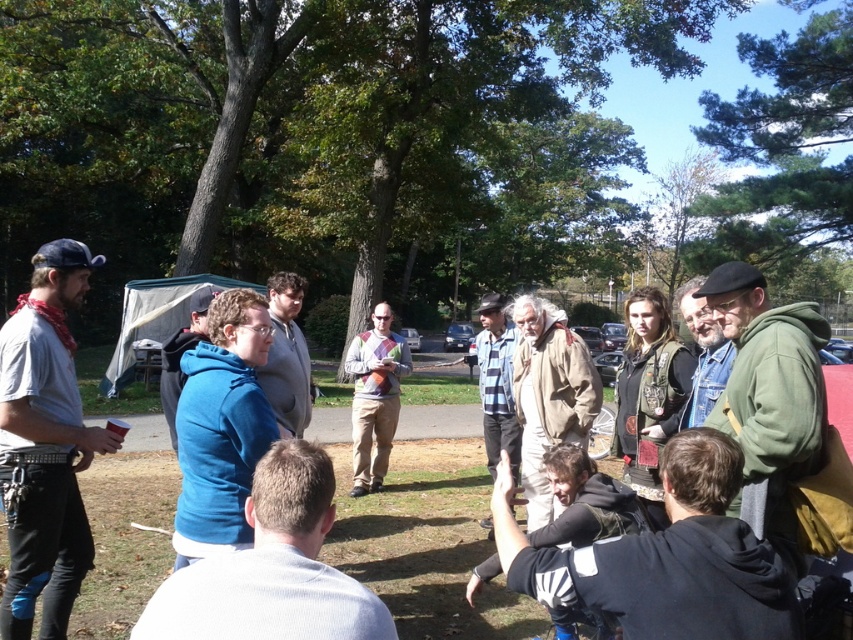
Question: Which of the following is the farthest from the observer?

Choices:
 (A) (276, 358)
 (B) (549, 387)
 (C) (181, 355)

Answer: (B)

Question: Is white ribbed sweater at center to the right of striped cotton shirt at center from the viewer's perspective?

Choices:
 (A) no
 (B) yes

Answer: (A)

Question: Which point is closer to the camera taking this photo?

Choices:
 (A) (496, 298)
 (B) (599, 397)
 (C) (306, 365)

Answer: (B)

Question: Can you confirm if denim shirt at left is thinner than white ribbed sweater at center?

Choices:
 (A) yes
 (B) no

Answer: (A)

Question: Can you confirm if white ribbed sweater at center is bigger than light brown suede jacket at center?

Choices:
 (A) no
 (B) yes

Answer: (B)

Question: Which object is positioned farthest from the light brown suede jacket at center?

Choices:
 (A) gray sweater at center
 (B) multicolored argyle sweater at center
 (C) denim shirt at left

Answer: (B)